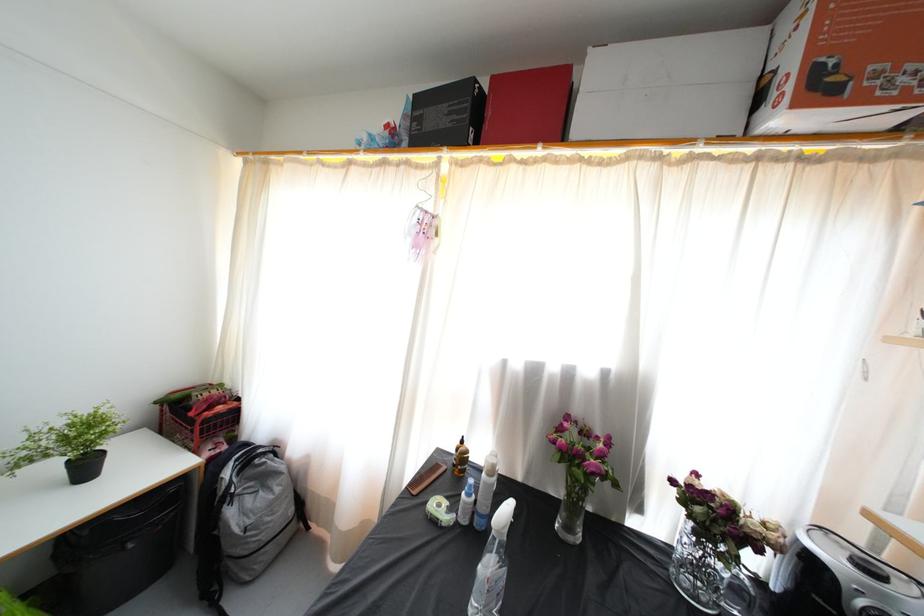
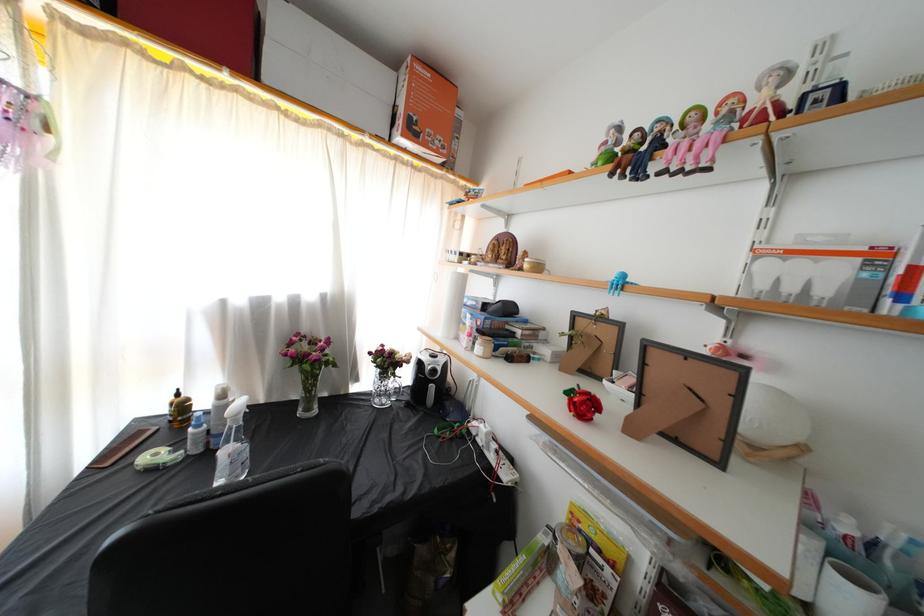
Find the pixel in the second image that matches point 827,94 in the first image.

(418, 137)